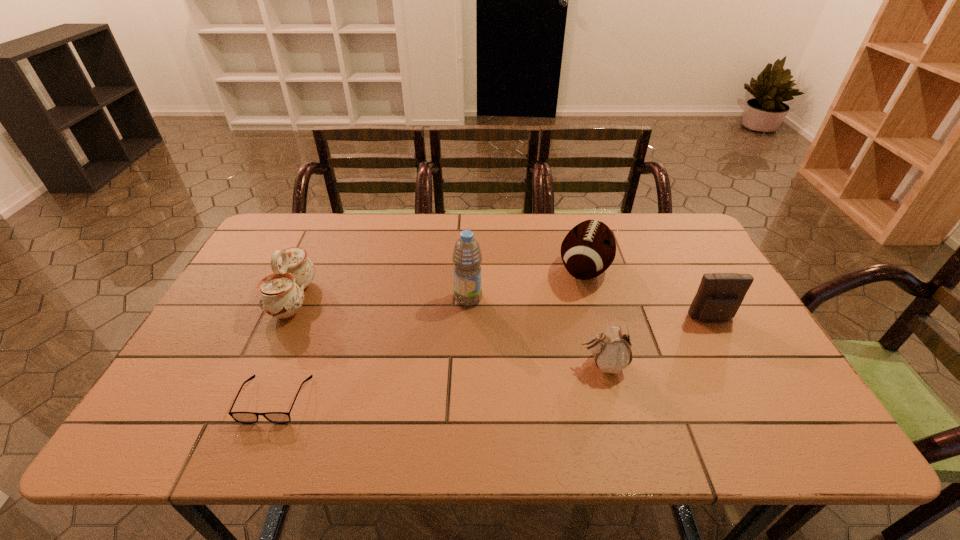
Locate an element on the screen. vacant region located on the back of the football (American) is located at coordinates (573, 228).

You are a GUI agent. You are given a task and a screenshot of the screen. Output one action in this format:
    pyautogui.click(x=<x>, y=<y>)
    Task: Click on the free spot located with an open flap on the farther pouch
    
    Given the screenshot: What is the action you would take?
    pyautogui.click(x=723, y=340)

You are a GUI agent. You are given a task and a screenshot of the screen. Output one action in this format:
    pyautogui.click(x=<x>, y=<y>)
    Task: Click on the free space located on the front-facing side of the nearer pouch
    This screenshot has width=960, height=540.
    Given the screenshot: What is the action you would take?
    [432, 364]

I want to click on free space located 0.320m on the front-facing side of the nearer pouch, so click(x=448, y=364).

Image resolution: width=960 pixels, height=540 pixels. What are the coordinates of `free location located on the front-facing side of the nearer pouch` in the screenshot? It's located at [420, 364].

Identify the location of object that is positioned at the far edge. The width and height of the screenshot is (960, 540). (589, 248).

The width and height of the screenshot is (960, 540). I want to click on object that is at the near edge, so click(241, 417).

Image resolution: width=960 pixels, height=540 pixels. Find the location of `object that is positioned at the left edge`. object that is positioned at the left edge is located at coordinates tap(281, 294).

This screenshot has width=960, height=540. What are the coordinates of `object positioned at the right edge` in the screenshot? It's located at (719, 296).

In the image, there is a desktop. At what (x,y) coordinates should I click in order to perform the action: click on free region at the far edge. Please return your answer as a coordinate pair (x, y). The height and width of the screenshot is (540, 960). Looking at the image, I should click on (553, 253).